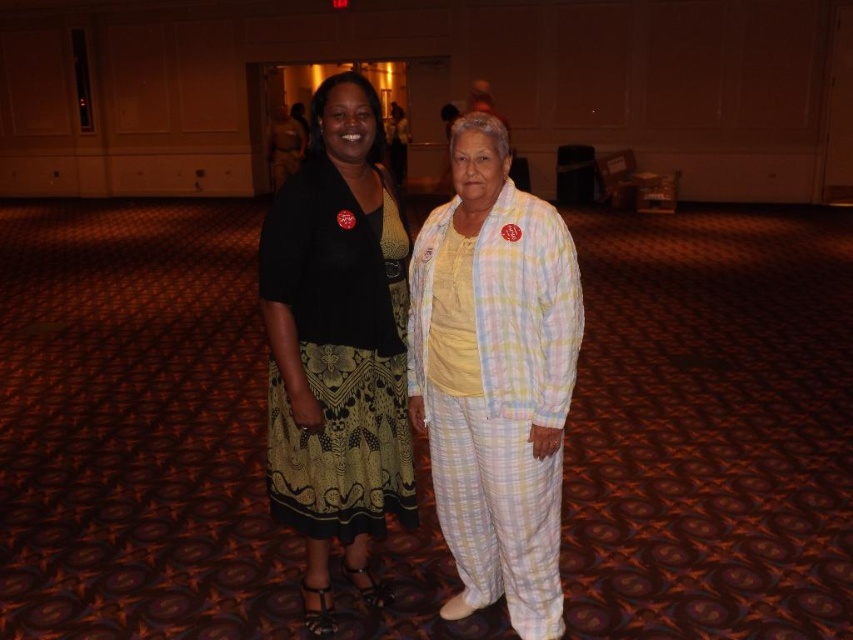
Question: Can you confirm if matte black skirt at center is positioned below black textured dress at center?

Choices:
 (A) no
 (B) yes

Answer: (A)

Question: Which point is farther from the camera taking this photo?

Choices:
 (A) (314, 212)
 (B) (288, 448)

Answer: (B)

Question: From the image, what is the correct spatial relationship of matte black skirt at center in relation to black textured dress at center?

Choices:
 (A) above
 (B) below

Answer: (A)

Question: Among these objects, which one is nearest to the camera?

Choices:
 (A) matte black skirt at center
 (B) black textured dress at center

Answer: (B)

Question: Is matte black skirt at center to the right of black textured dress at center from the viewer's perspective?

Choices:
 (A) yes
 (B) no

Answer: (A)